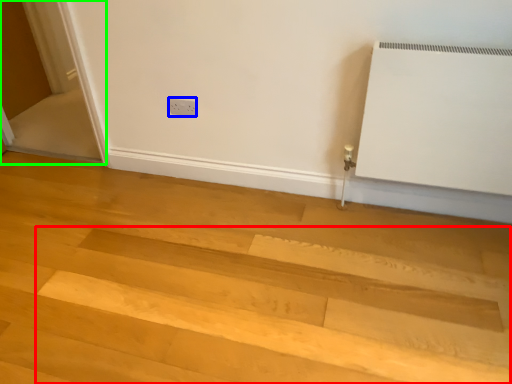
Question: Which object is the farthest from stairwell (highlighted by a red box)? Choose among these: electric outlet (highlighted by a blue box) or screen door (highlighted by a green box).

Choices:
 (A) electric outlet
 (B) screen door

Answer: (B)